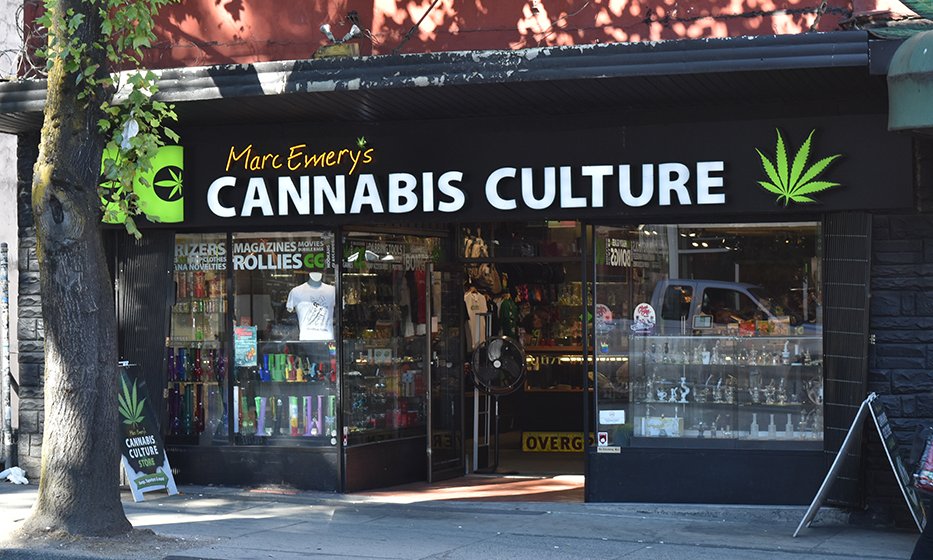
Identify the location of black painted brick walls. The image size is (933, 560). (33, 307), (906, 320).